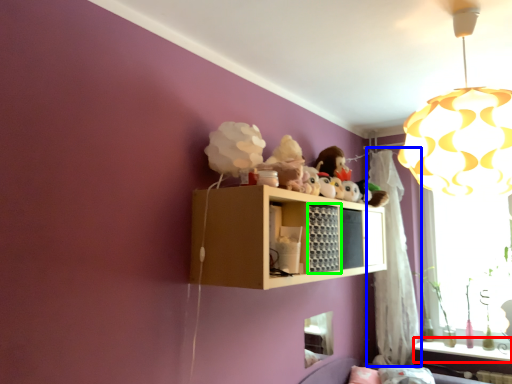
Question: Which is nearer to the window sill (highlighted by a red box)? curtain (highlighted by a blue box) or cabinet (highlighted by a green box).

Choices:
 (A) curtain
 (B) cabinet

Answer: (A)